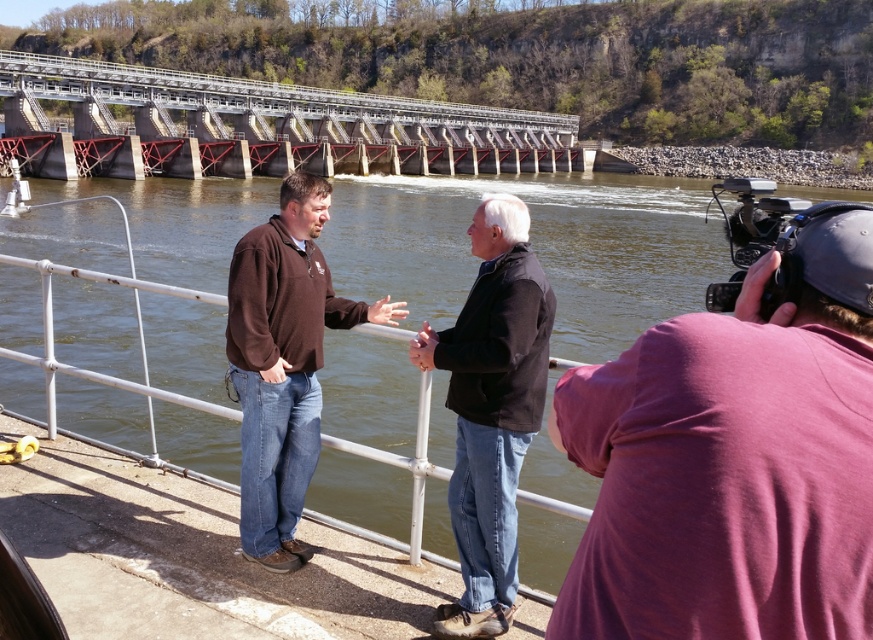
Can you confirm if greenish-brown water at center is taller than black matte jacket at center?

Indeed, greenish-brown water at center has a greater height compared to black matte jacket at center.

Who is taller, greenish-brown water at center or black matte jacket at center?

greenish-brown water at center

Is point (394, 499) positioned after point (479, 316)?

Yes.

Identify the location of greenish-brown water at center. The width and height of the screenshot is (873, 640). (534, 248).

Consider the image. Can you confirm if black matte jacket at center is positioned to the right of brown fleece at center?

Indeed, black matte jacket at center is positioned on the right side of brown fleece at center.

Who is more forward, (493, 381) or (283, 445)?

Point (493, 381) is more forward.

In order to click on black matte jacket at center in this screenshot , I will do `click(491, 410)`.

Does purple cotton shirt at right appear under red metal bridge at upper center?

Indeed, purple cotton shirt at right is positioned under red metal bridge at upper center.

Between point (839, 522) and point (65, 173), which one is positioned in front?

Point (839, 522) is in front.

The width and height of the screenshot is (873, 640). Identify the location of purple cotton shirt at right. (733, 460).